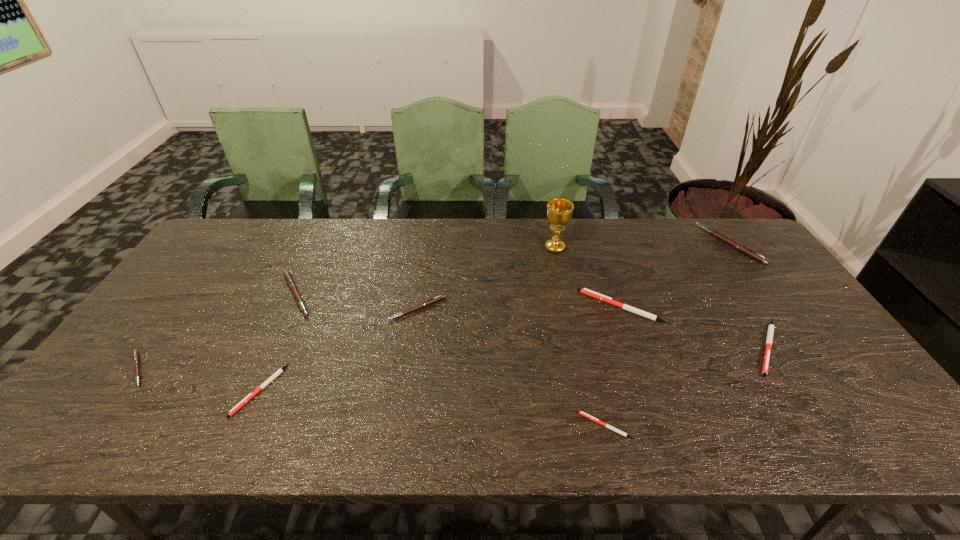
Find the location of a particular element. pen identified as the fifth closest to the second biggest pink pen is located at coordinates (585, 291).

Point out which pen is positioned as the nearest to the biggest white pen. Please provide its 2D coordinates. Your answer should be formatted as a tuple, i.e. [(x, y)], where the tuple contains the x and y coordinates of a point satisfying the conditions above.

[(771, 327)]

Choose which pink pen is the second nearest neighbor to the leftmost white pen. Please provide its 2D coordinates. Your answer should be formatted as a tuple, i.e. [(x, y)], where the tuple contains the x and y coordinates of a point satisfying the conditions above.

[(135, 352)]

Select which pink pen is the closest to the fourth pen from left to right. Please provide its 2D coordinates. Your answer should be formatted as a tuple, i.e. [(x, y)], where the tuple contains the x and y coordinates of a point satisfying the conditions above.

[(288, 277)]

Identify the location of white pen that is the fourth closest to the gold chalice. Image resolution: width=960 pixels, height=540 pixels. (269, 380).

Find the location of a particular element. the closest white pen relative to the nearest pink pen is located at coordinates click(269, 380).

The image size is (960, 540). I want to click on free space that satisfies the following two spatial constraints: 1. on the clicker of the biggest white pen; 2. on the clicker of the leftmost white pen, so click(x=649, y=390).

Identify the location of free location that satisfies the following two spatial constraints: 1. on the front side of the tallest object; 2. at the nib of the second pink pen from left to right. The height and width of the screenshot is (540, 960). (564, 295).